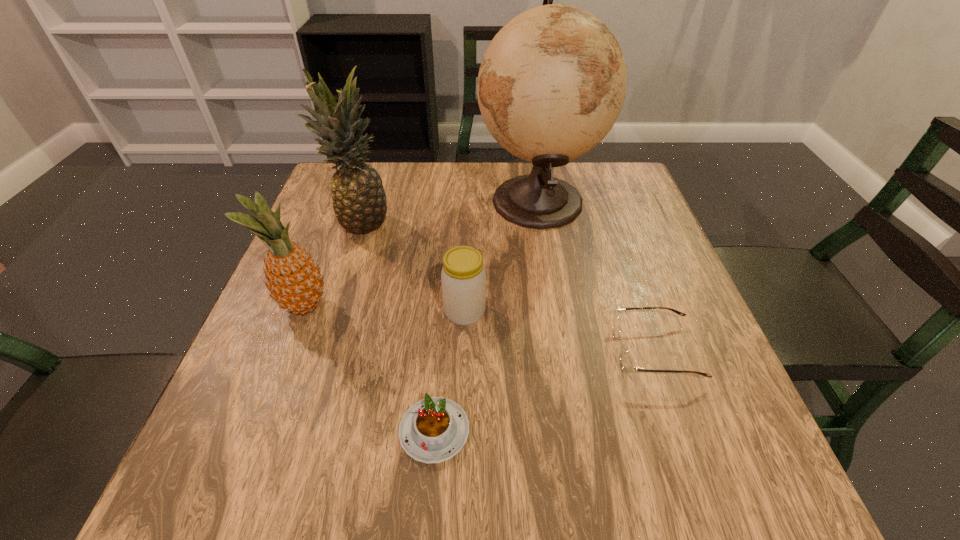
Where is `the tallest object`? The image size is (960, 540). the tallest object is located at coordinates (552, 83).

Locate an element on the screen. This screenshot has height=540, width=960. the farther pineapple is located at coordinates (358, 197).

Identify the location of the taller pineapple. This screenshot has height=540, width=960. (358, 197).

At what (x,y) coordinates should I click in order to perform the action: click on the third tallest object. Please return your answer as a coordinate pair (x, y). The height and width of the screenshot is (540, 960). Looking at the image, I should click on (294, 281).

Identify the location of the nearer pineapple. (294, 281).

This screenshot has width=960, height=540. I want to click on jar, so click(463, 277).

Find the location of a particular element. The height and width of the screenshot is (540, 960). spectacles is located at coordinates (627, 365).

You are a GUI agent. You are given a task and a screenshot of the screen. Output one action in this format:
    pyautogui.click(x=<x>, y=<y>)
    Task: Click on the shortest object
    Image resolution: width=960 pixels, height=540 pixels.
    Given the screenshot: What is the action you would take?
    pyautogui.click(x=433, y=430)

At what (x,y) coordinates should I click in order to perform the action: click on pudding. Please return your answer as a coordinate pair (x, y). Image resolution: width=960 pixels, height=540 pixels. Looking at the image, I should click on (433, 430).

Where is `free space located on the front-facing side of the tallest object`? free space located on the front-facing side of the tallest object is located at coordinates (440, 200).